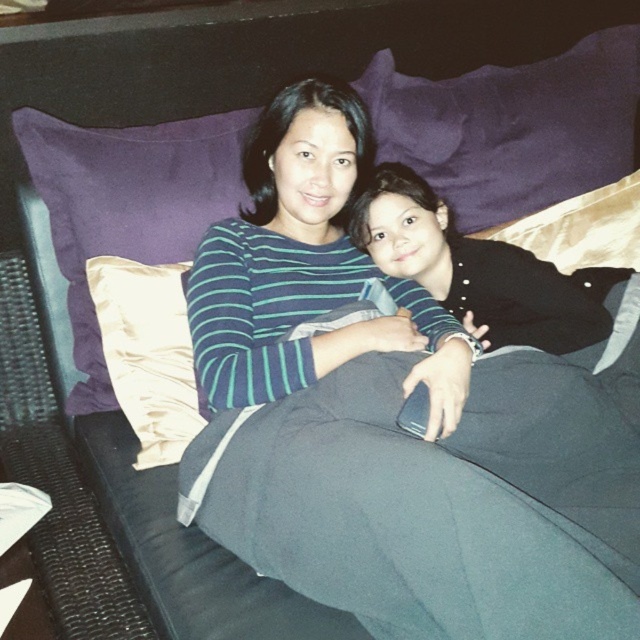
Between purple fabric pillow at upper center and satin beige pillow at left, which one is positioned higher?

purple fabric pillow at upper center

Is purple fabric pillow at upper center taller than satin beige pillow at left?

Yes.

This screenshot has height=640, width=640. What do you see at coordinates (512, 125) in the screenshot?
I see `purple fabric pillow at upper center` at bounding box center [512, 125].

Identify the location of purple fabric pillow at upper center. (512, 125).

Between point (108, 381) and point (147, 426), which one is positioned behind?

Positioned behind is point (108, 381).

Is satin cushion at upper left below satin beige pillow at left?

No, satin cushion at upper left is not below satin beige pillow at left.

Image resolution: width=640 pixels, height=640 pixels. Identify the location of satin cushion at upper left. (128, 205).

Is purple fabric pillow at upper center wider than satin cushion at upper left?

Indeed, purple fabric pillow at upper center has a greater width compared to satin cushion at upper left.

Who is positioned more to the right, purple fabric pillow at upper center or satin cushion at upper left?

purple fabric pillow at upper center is more to the right.

I want to click on purple fabric pillow at upper center, so click(x=512, y=125).